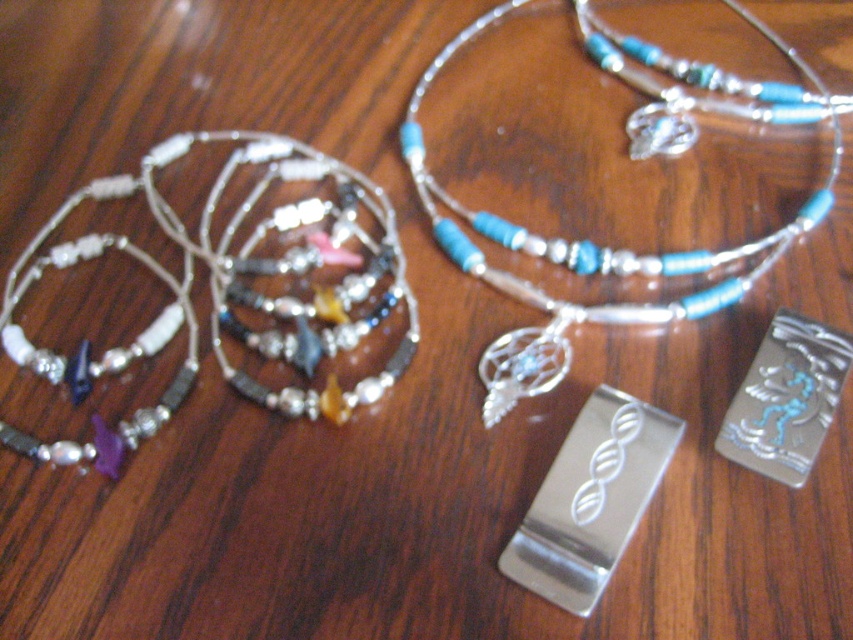
You are a jeweler examining two necklaces on a wooden surface. The multicolored beaded necklace at left and the blue beaded necklace at center are both in front of you. Which necklace has a larger diameter?

The blue beaded necklace at center has a larger diameter than the multicolored beaded necklace at left because the multicolored beaded necklace at left is thinner than blue beaded necklace at center.